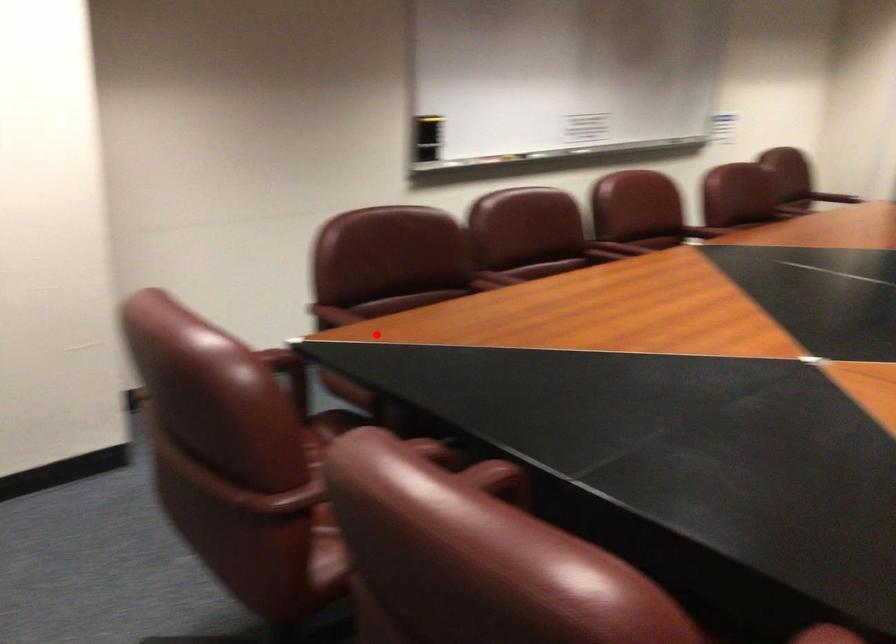
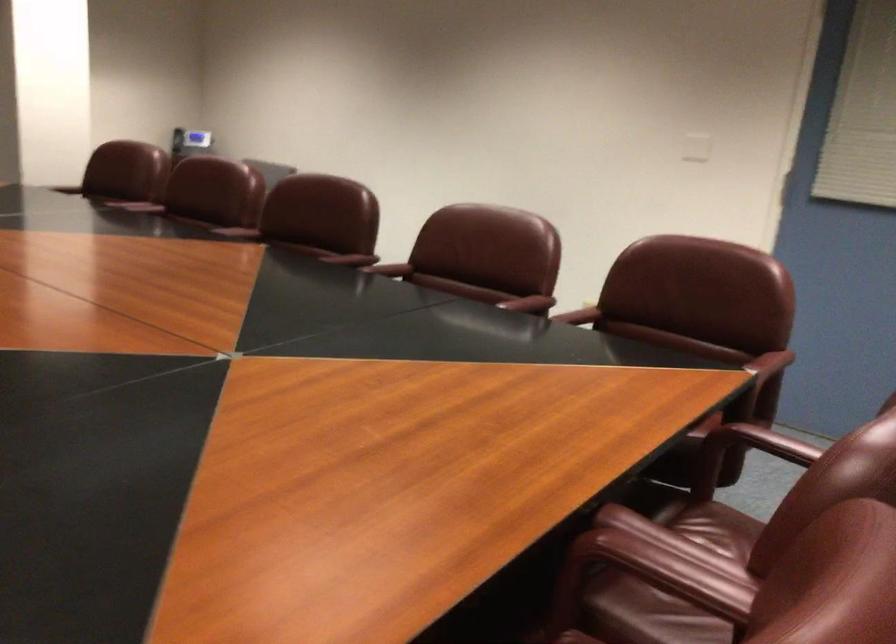
Question: I am providing you with two images of the same scene from different viewpoints. A red point is shown in image1. For the corresponding object point in image2, is it positioned nearer or farther from the camera?

Choices:
 (A) Nearer
 (B) Farther

Answer: (A)